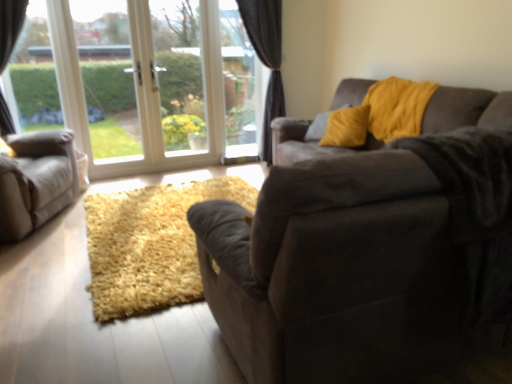
Question: Is dark gray velvet curtain at center thinner than transparent glass door at upper left, the 3th window screen from the right?

Choices:
 (A) yes
 (B) no

Answer: (B)

Question: Is dark gray velvet curtain at center shorter than transparent glass door at upper left, the 3th window screen from the right?

Choices:
 (A) no
 (B) yes

Answer: (A)

Question: Considering the relative sizes of dark gray velvet curtain at center and transparent glass door at upper left, the 3th window screen from the right, in the image provided, is dark gray velvet curtain at center bigger than transparent glass door at upper left, the 3th window screen from the right,?

Choices:
 (A) no
 (B) yes

Answer: (B)

Question: Is dark gray velvet curtain at center behind transparent glass door at upper left, positioned as the 1th window screen in left-to-right order?

Choices:
 (A) yes
 (B) no

Answer: (A)

Question: Can you confirm if dark gray velvet curtain at center is positioned to the left of transparent glass door at upper left, positioned as the 1th window screen in left-to-right order?

Choices:
 (A) no
 (B) yes

Answer: (A)

Question: In the image, is yellow velvet pillow at upper right positioned in front of or behind transparent glass door at upper left, the 3th window screen from the right?

Choices:
 (A) front
 (B) behind

Answer: (A)

Question: Is point (353, 127) positioned closer to the camera than point (121, 23)?

Choices:
 (A) farther
 (B) closer

Answer: (B)

Question: From the image's perspective, is yellow velvet pillow at upper right above or below transparent glass door at upper left, the 3th window screen from the right?

Choices:
 (A) above
 (B) below

Answer: (B)

Question: In the image, is yellow velvet pillow at upper right on the left side or the right side of transparent glass door at upper left, the 3th window screen from the right?

Choices:
 (A) right
 (B) left

Answer: (A)

Question: In terms of size, does yellow velvet pillow at upper right appear bigger or smaller than shaggy yellow rug at center?

Choices:
 (A) small
 (B) big

Answer: (A)

Question: From a real-world perspective, is yellow velvet pillow at upper right positioned above or below shaggy yellow rug at center?

Choices:
 (A) below
 (B) above

Answer: (B)

Question: From the image's perspective, relative to shaggy yellow rug at center, is yellow velvet pillow at upper right above or below?

Choices:
 (A) below
 (B) above

Answer: (B)

Question: In the image, is yellow velvet pillow at upper right on the left side or the right side of shaggy yellow rug at center?

Choices:
 (A) right
 (B) left

Answer: (A)

Question: Considering their positions, is white glass door at center, acting as the second window screen starting from the left, located in front of or behind transparent glass door at upper left, positioned as the 1th window screen in left-to-right order?

Choices:
 (A) front
 (B) behind

Answer: (B)

Question: From a real-world perspective, is white glass door at center, acting as the second window screen starting from the left, positioned above or below transparent glass door at upper left, the 3th window screen from the right?

Choices:
 (A) below
 (B) above

Answer: (B)